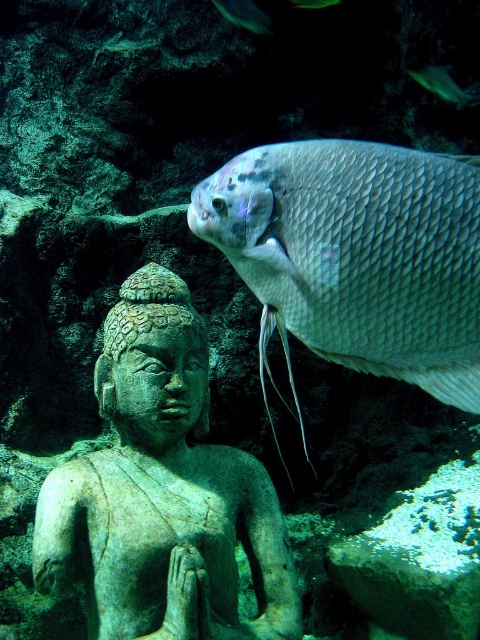
Which of these two, green stone statue at center or shiny silver fish at upper right, stands taller?

With more height is green stone statue at center.

Who is more distant from viewer, (66, 490) or (330, 148)?

Point (66, 490)

Who is more forward, [137,442] or [333,232]?

Positioned in front is point [333,232].

You are a GUI agent. You are given a task and a screenshot of the screen. Output one action in this format:
    pyautogui.click(x=<x>, y=<y>)
    Task: Click on the green stone statue at center
    
    Given the screenshot: What is the action you would take?
    pyautogui.click(x=163, y=492)